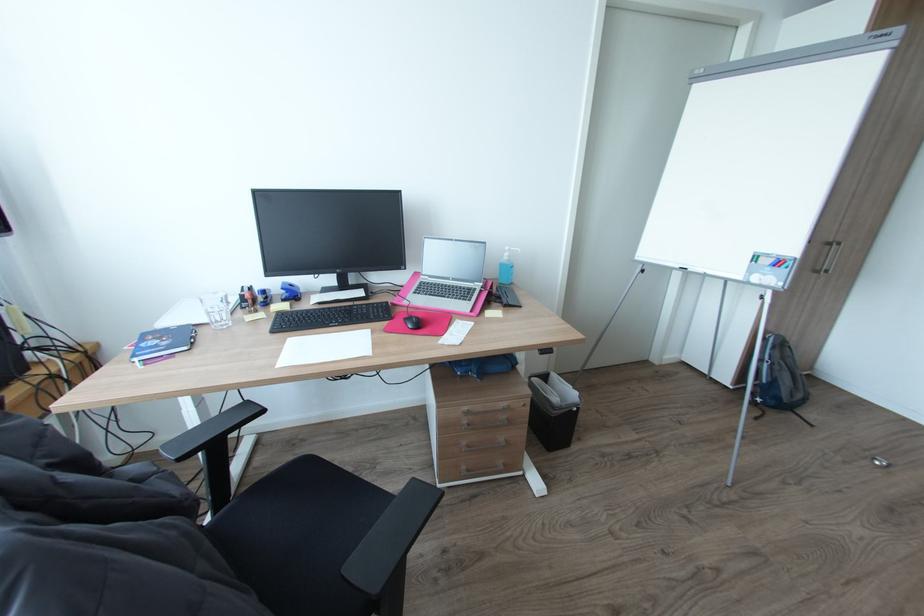
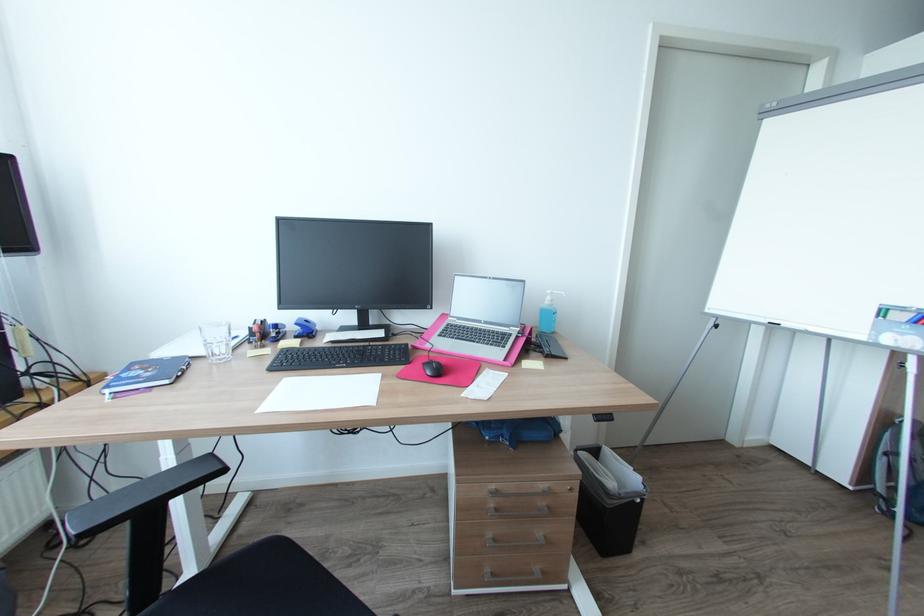
The point at (x=470, y=408) is marked in the first image. Where is the corresponding point in the second image?

(497, 487)